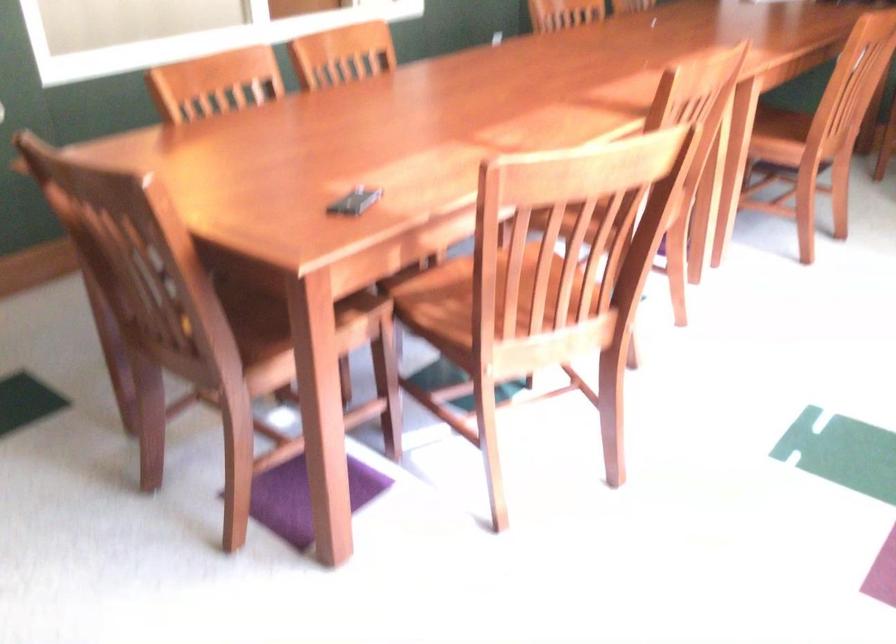
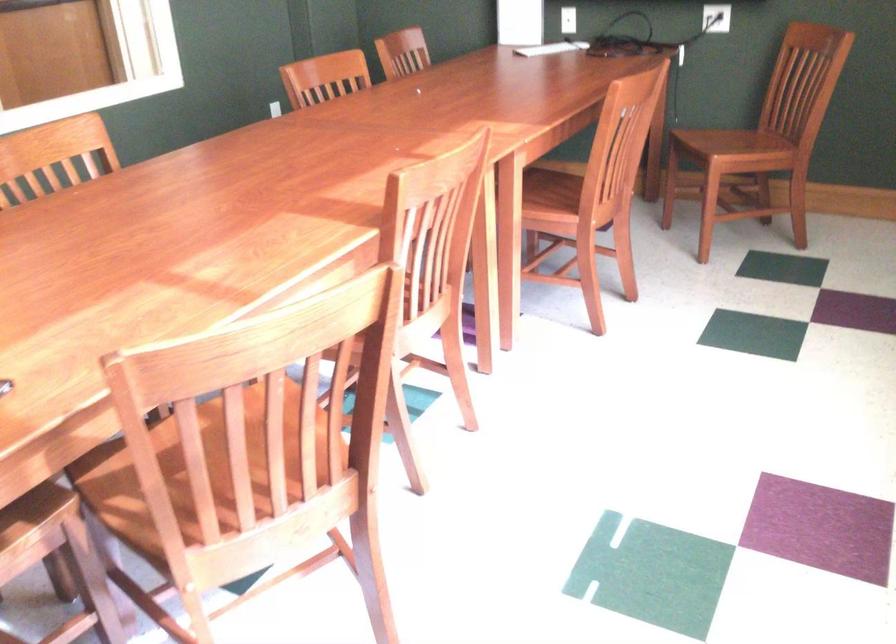
Consider the image. What movement of the cameraman would produce the second image?

The movement direction of the cameraman is right, forward.